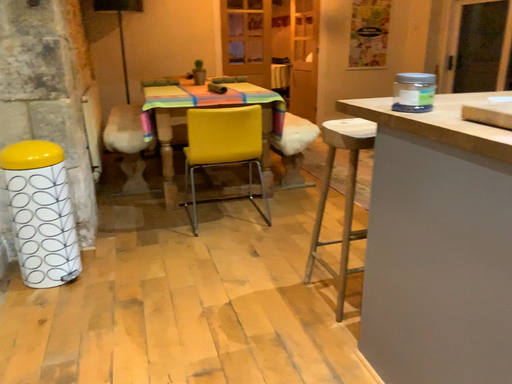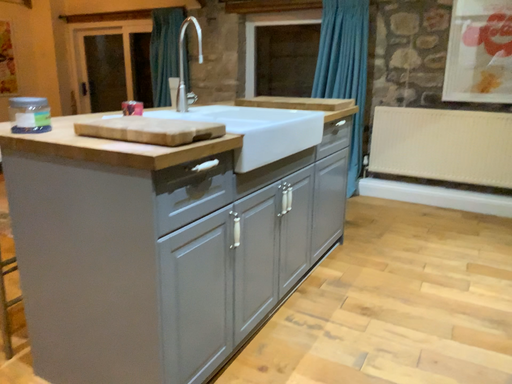
Question: Which way did the camera rotate in the video?

Choices:
 (A) rotated downward
 (B) rotated upward

Answer: (B)